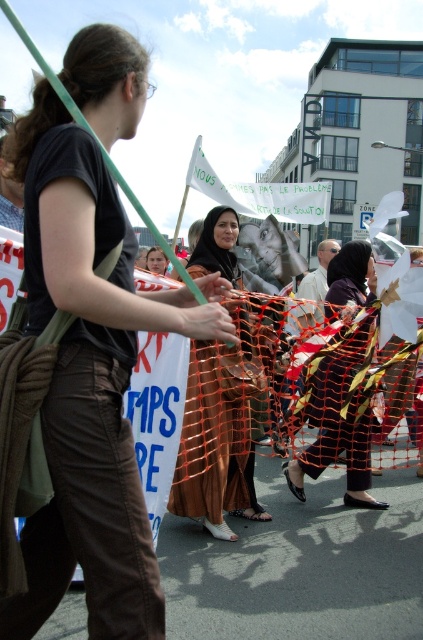
Question: Can you confirm if brown cotton pants at left is positioned to the right of brown satin dress at center?

Choices:
 (A) no
 (B) yes

Answer: (A)

Question: Which of the following is the farthest from the observer?

Choices:
 (A) brown cotton pants at left
 (B) black fabric hijab at center

Answer: (B)

Question: Which point is closer to the camera?

Choices:
 (A) (335, 372)
 (B) (203, 244)

Answer: (A)

Question: Does brown cotton pants at left appear on the left side of brown satin dress at center?

Choices:
 (A) no
 (B) yes

Answer: (B)

Question: Which point is farther to the camera?

Choices:
 (A) (71, 193)
 (B) (340, 336)

Answer: (B)

Question: Is brown cotton pants at left positioned at the back of black fabric hijab at center?

Choices:
 (A) no
 (B) yes

Answer: (A)